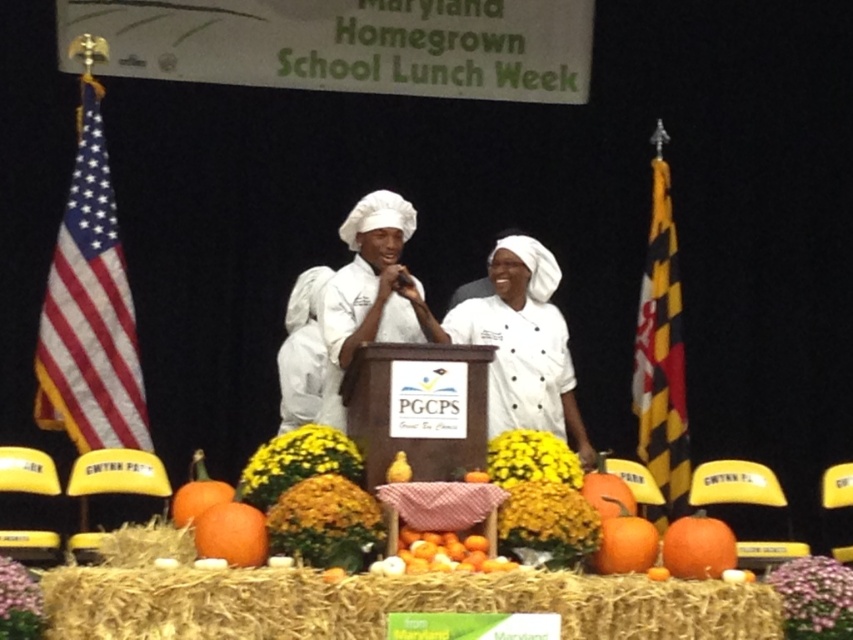
You are organizing a school event and need to know the relative sizes of the objects on stage for a presentation layout. Which object is wider, the american flag at left or the orange matte pumpkin at center?

The american flag at left might be wider than orange matte pumpkin at center according to the description.

Looking at this image, you are an event planner organizing the Maryland Homegrown School Lunch Week event. You need to ensure that the orange matte pumpkin at center and the orange matte at center are visible to the audience. Which object should be placed in front to ensure both are visible?

The orange matte pumpkin at center is much taller than the orange matte at center, so to ensure both are visible, the shorter orange matte at center should be placed in front of the taller pumpkin. This way, the pumpkin won not block the view of the matte.

You are attending the Maryland Homegrown School Lunch Week event and notice the american flag at left and the orange matte pumpkin at center. Which object is positioned higher in the scene?

The american flag at left is located above the orange matte pumpkin at center, so it is positioned higher in the scene.